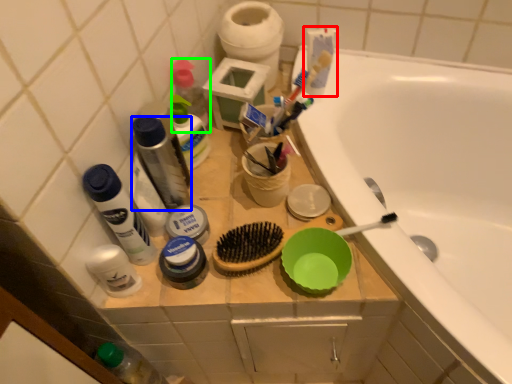
Question: Estimate the real-world distances between objects in this image. Which object is farther from toothpaste (highlighted by a red box), mouthwash (highlighted by a blue box) or toiletry (highlighted by a green box)?

Choices:
 (A) mouthwash
 (B) toiletry

Answer: (A)